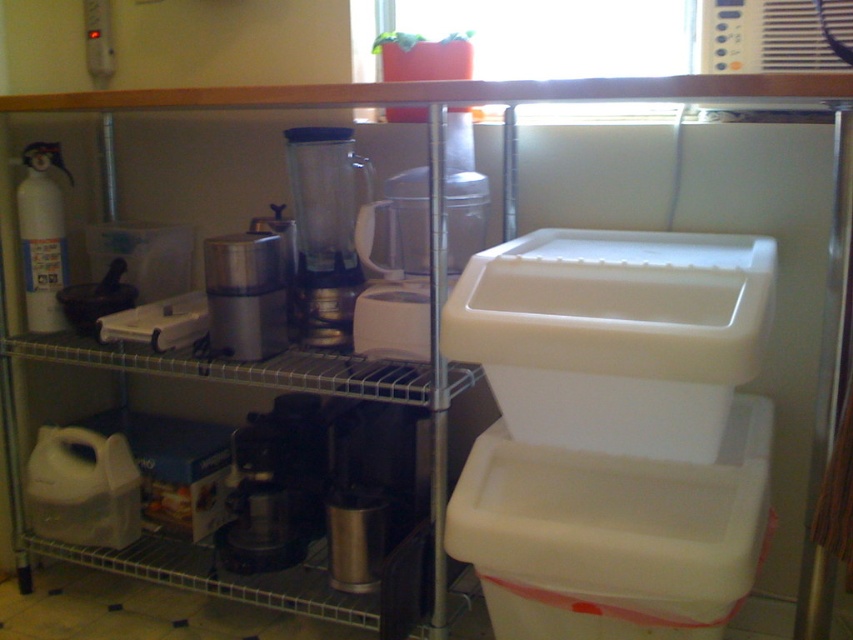
You are organizing the kitchen shelves and need to place a new item that requires more space than the clear plastic blender at center. Where should you place it, considering the white plastic container at center right is already occupying space?

The white plastic container at center right has a larger size compared to the clear plastic blender at center, so you can place the new item where the white plastic container at center right is located since it has more space available.

You are standing in front of the kitchen shelving unit and see two points marked on the shelves. Which point, point (312, 236) or point (283, 256), is closer to you?

Point (312, 236) is further to the camera than point (283, 256), so the closer point to you is point (283, 256).